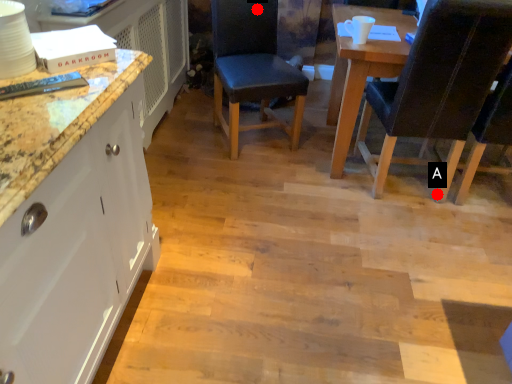
Question: Two points are circled on the image, labeled by A and B beside each circle. Which of the following is the farthest from the observer?

Choices:
 (A) A is further
 (B) B is further

Answer: (B)